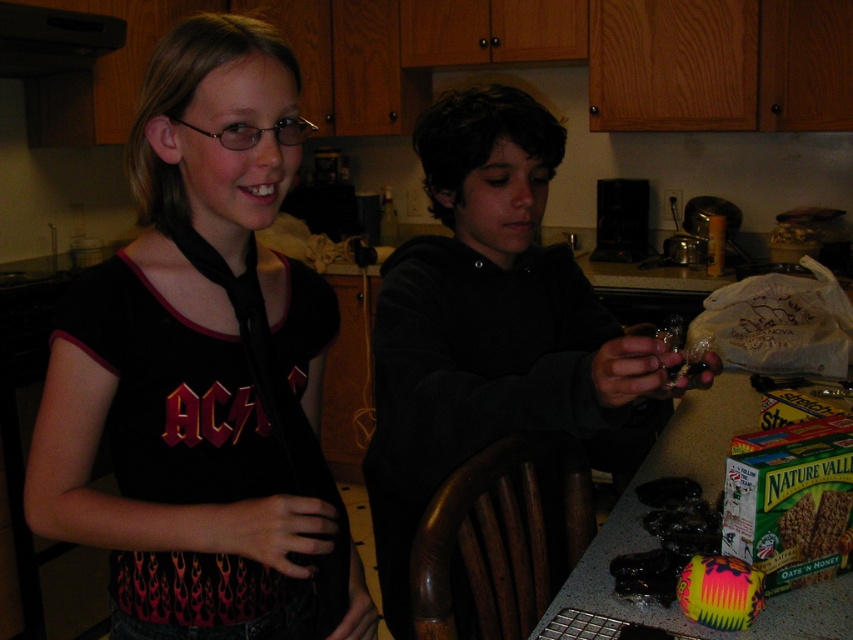
Question: Is black matte tie at center smaller than multicolored fabric bag at lower right?

Choices:
 (A) no
 (B) yes

Answer: (A)

Question: Which point is closer to the camera?

Choices:
 (A) multicolored fabric bag at lower right
 (B) black matte tie at center

Answer: (B)

Question: Is black matte tie at center closer to the viewer compared to multicolored fabric bag at lower right?

Choices:
 (A) no
 (B) yes

Answer: (B)

Question: Which of the following is the farthest from the observer?

Choices:
 (A) multicolored fabric bag at lower right
 (B) black matte tie at center
 (C) dark gray hoodie at center

Answer: (A)

Question: Considering the relative positions of black matte tie at center and dark gray hoodie at center in the image provided, where is black matte tie at center located with respect to dark gray hoodie at center?

Choices:
 (A) above
 (B) below

Answer: (A)

Question: Among these points, which one is nearest to the camera?

Choices:
 (A) (409, 541)
 (B) (164, 602)
 (C) (717, 600)

Answer: (C)